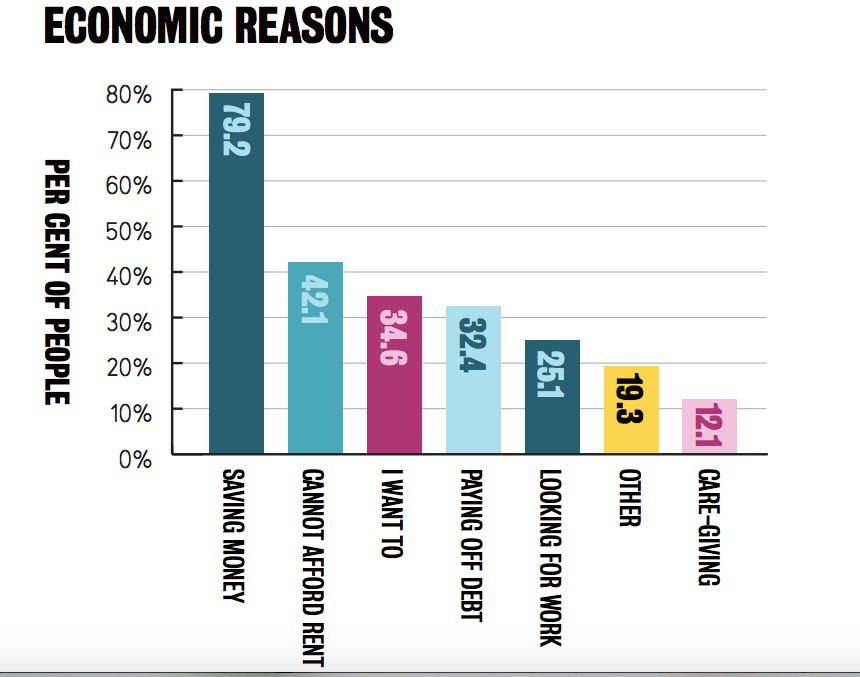
You are a GUI agent. You are given a task and a screenshot of the screen. Output one action in this format:
    pyautogui.click(x=<x>, y=<y>)
    Task: Click on the bar
    This screenshot has height=677, width=860.
    Given the screenshot: What is the action you would take?
    pyautogui.click(x=316, y=395)